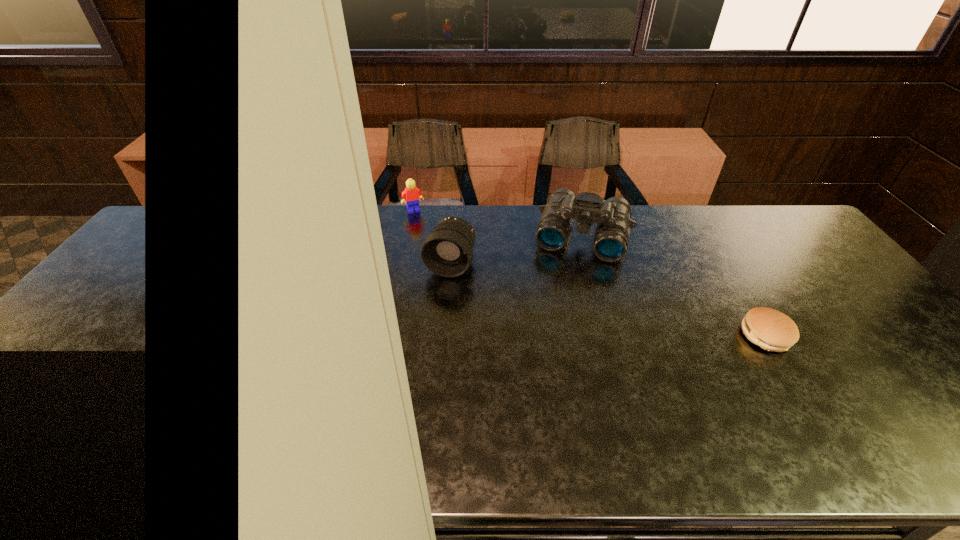
This screenshot has width=960, height=540. I want to click on vacant point at the left edge, so click(x=148, y=280).

This screenshot has height=540, width=960. Identify the location of free region at the right edge of the desktop. (806, 269).

Locate an element on the screen. This screenshot has width=960, height=540. free space between the binoculars and the telephoto lens is located at coordinates (516, 250).

Where is `vacant space that is in between the leftmost object and the third object from left to right`? vacant space that is in between the leftmost object and the third object from left to right is located at coordinates (498, 223).

The height and width of the screenshot is (540, 960). I want to click on free space between the second object from left to right and the binoculars, so click(516, 250).

The image size is (960, 540). What are the coordinates of `vacant region between the third object from left to right and the patty` in the screenshot? It's located at (674, 286).

Find the location of `free area in between the third object from right to left and the shortest object`. free area in between the third object from right to left and the shortest object is located at coordinates (608, 300).

Identify which object is located as the nearest to the patty. Please provide its 2D coordinates. Your answer should be formatted as a tuple, i.e. [(x, y)], where the tuple contains the x and y coordinates of a point satisfying the conditions above.

[(612, 216)]

Where is `object that stands as the second closest to the second shortest object`? This screenshot has height=540, width=960. object that stands as the second closest to the second shortest object is located at coordinates (612, 216).

Where is `vacant space that satisfies the following two spatial constraints: 1. on the front side of the third object from right to left; 2. on the left side of the leftmost object`? vacant space that satisfies the following two spatial constraints: 1. on the front side of the third object from right to left; 2. on the left side of the leftmost object is located at coordinates (403, 264).